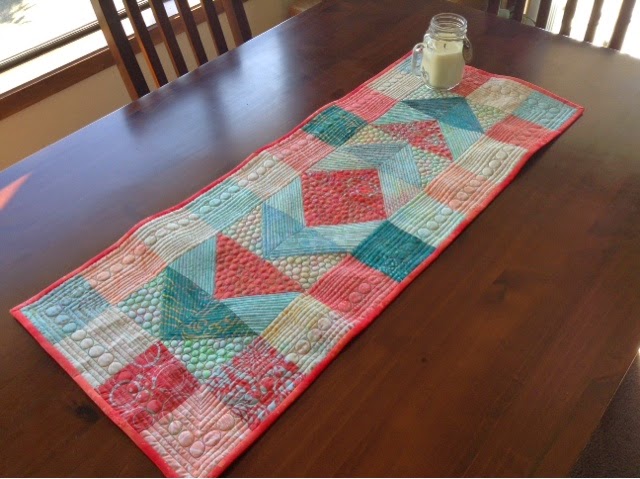
What are the coordinates of `window` in the screenshot? It's located at (57, 11).